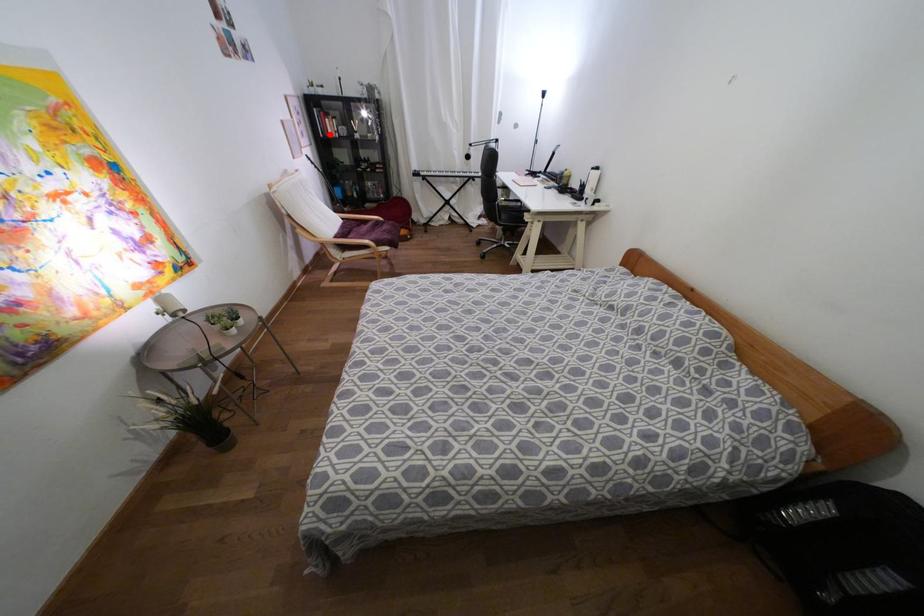
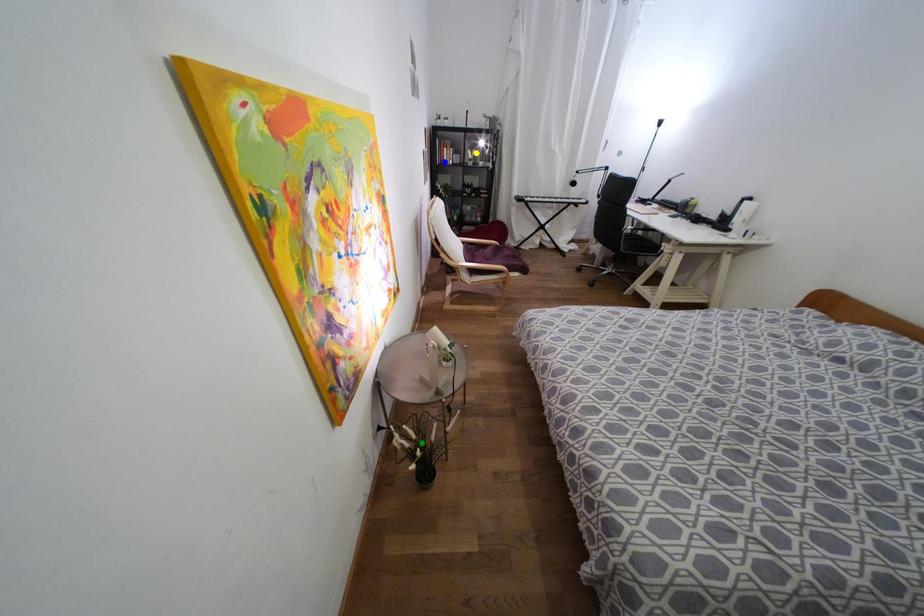
Question: I am providing you with two images of the same scene from different viewpoints. A red point is marked on the first image. You are given multiple points on the second image. Which point in image 2 is actually the same real-world point as the red point in image 1?

Choices:
 (A) blue point
 (B) green point
 (C) yellow point

Answer: (A)